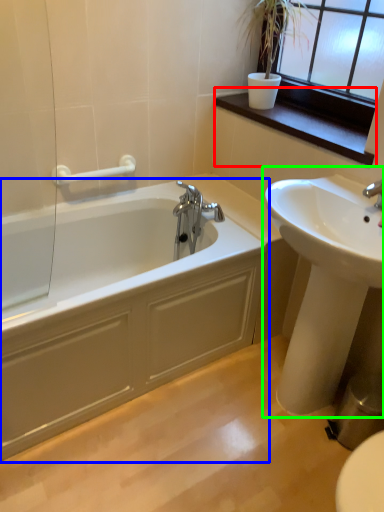
Question: Considering the real-world distances, which object is farthest from window sill (highlighted by a red box)? bathtub (highlighted by a blue box) or sink (highlighted by a green box)?

Choices:
 (A) bathtub
 (B) sink

Answer: (A)